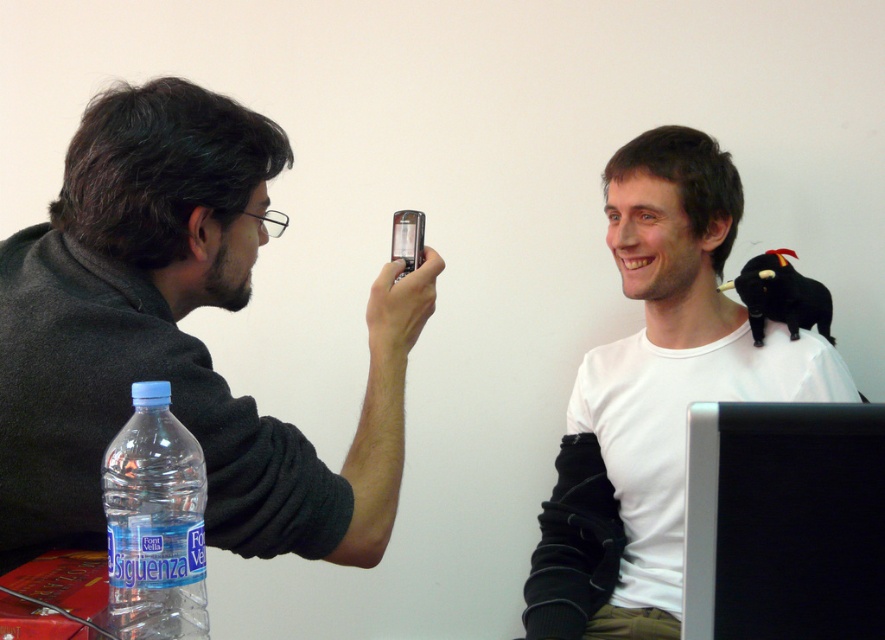
You are setting up a desk and need to know which object is shorter between the black glossy monitor at lower right and the transparent plastic bottle at lower left. Can you tell me which one is shorter?

The black glossy monitor at lower right is not as tall as the transparent plastic bottle at lower left, so the black glossy monitor at lower right is shorter.